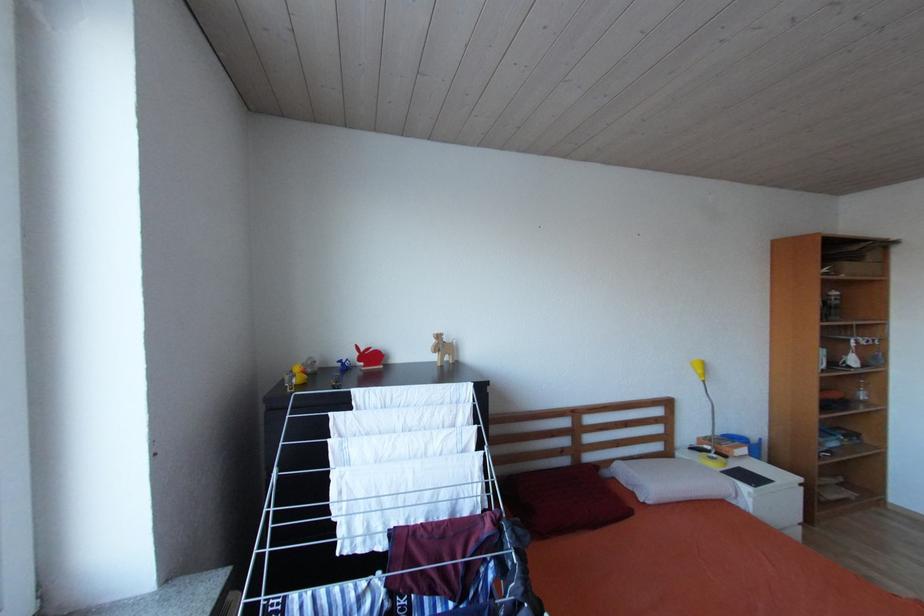
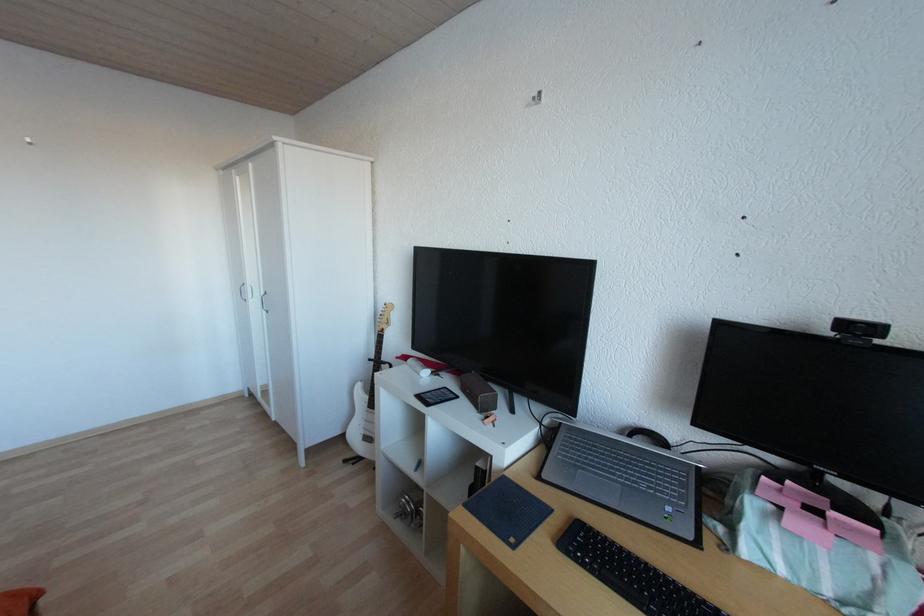
Question: The first image is from the beginning of the video and the second image is from the end. How did the camera likely rotate when shooting the video?

Choices:
 (A) Left
 (B) Right
 (C) Up
 (D) Down

Answer: (B)